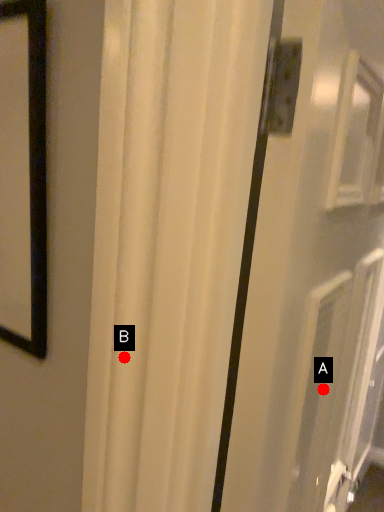
Question: Two points are circled on the image, labeled by A and B beside each circle. Among these points, which one is nearest to the camera?

Choices:
 (A) A is closer
 (B) B is closer

Answer: (B)